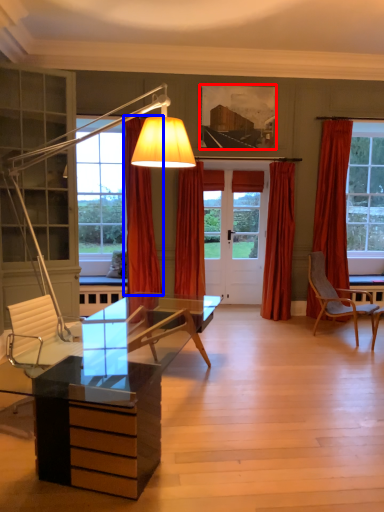
Question: Which of the following is the farthest to the observer, picture frame (highlighted by a red box) or curtain (highlighted by a blue box)?

Choices:
 (A) picture frame
 (B) curtain

Answer: (A)